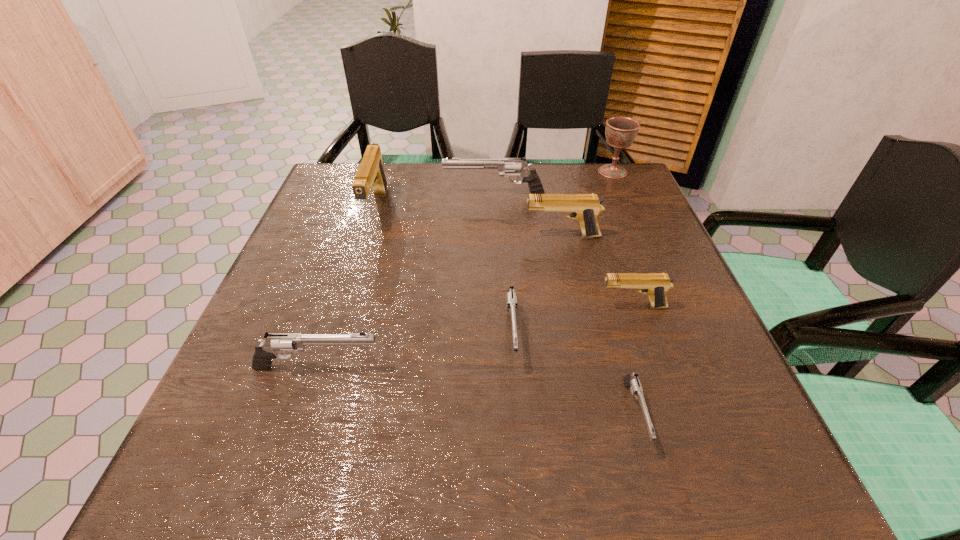
You are a GUI agent. You are given a task and a screenshot of the screen. Output one action in this format:
    pyautogui.click(x=<x>, y=<y>)
    Task: Click on the unoccupied position between the second biggest tan pistol and the shortest object
    The width and height of the screenshot is (960, 540).
    Given the screenshot: What is the action you would take?
    pyautogui.click(x=598, y=325)

What are the coordinates of `vacant space in between the leftmost tan pistol and the seventh tallest object` in the screenshot? It's located at (444, 271).

Identify the location of free space between the smallest tan pistol and the rightmost silver pistol. (634, 360).

The width and height of the screenshot is (960, 540). In order to click on unoccupied area between the biggest silver pistol and the second smallest silver pistol in this screenshot , I will do pos(503,264).

This screenshot has width=960, height=540. What are the coordinates of `vacant area that lies between the second smallest silver pistol and the second biggest silver pistol` in the screenshot? It's located at (415, 350).

In order to click on vacant area that lies between the farthest object and the leftmost silver pistol in this screenshot , I will do `click(465, 269)`.

Where is `vacant space that is in between the second shortest object and the second smallest tan pistol`? The image size is (960, 540). vacant space that is in between the second shortest object and the second smallest tan pistol is located at coordinates (537, 285).

Where is `object that can be found as the fifth closest to the third biggest silver pistol`? This screenshot has height=540, width=960. object that can be found as the fifth closest to the third biggest silver pistol is located at coordinates (370, 175).

Identify which object is the second closest to the second smallest tan pistol. Please provide its 2D coordinates. Your answer should be formatted as a tuple, i.e. [(x, y)], where the tuple contains the x and y coordinates of a point satisfying the conditions above.

[(511, 297)]

Identify which pistol is the second nearest to the farthest silver pistol. Please provide its 2D coordinates. Your answer should be formatted as a tuple, i.e. [(x, y)], where the tuple contains the x and y coordinates of a point satisfying the conditions above.

[(585, 208)]